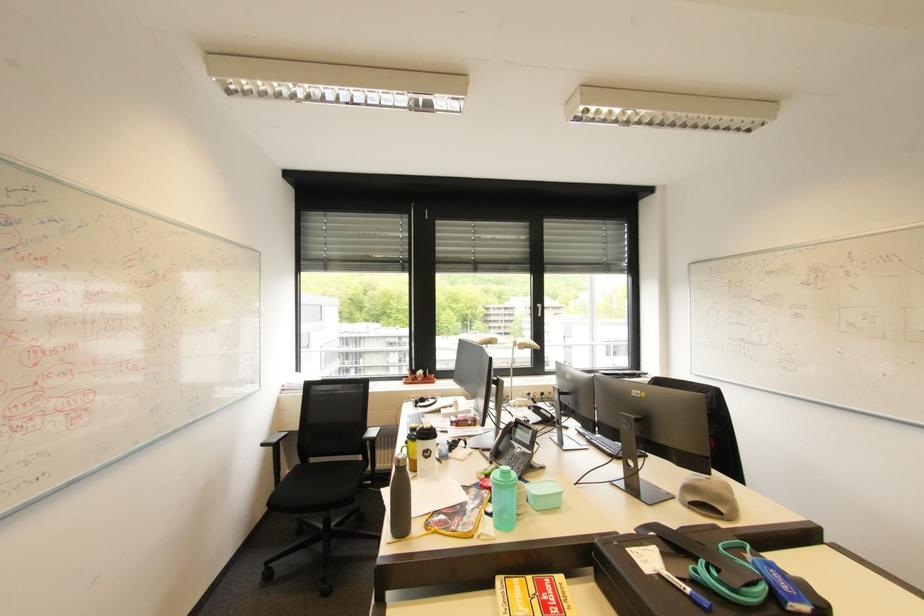
Locate an element on the screen. silver window handle is located at coordinates (539, 310).